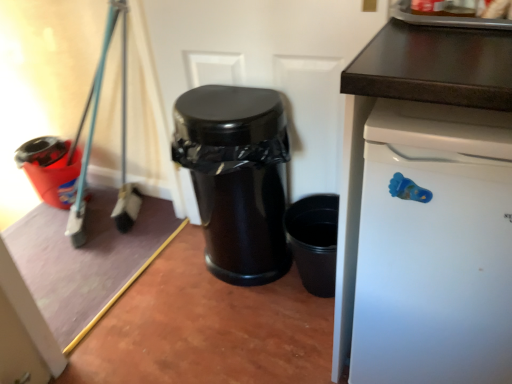
Question: Is point (59, 142) closer or farther from the camera than point (234, 142)?

Choices:
 (A) closer
 (B) farther

Answer: (B)

Question: Looking at the image, does matte plastic bucket at left, placed as the 2th waste container when sorted from front to back, seem bigger or smaller compared to glossy black trash can at center, the second waste container when ordered from left to right?

Choices:
 (A) small
 (B) big

Answer: (A)

Question: Which object is the farthest from the white matte dishwasher at right?

Choices:
 (A) glossy black trash can at center, which is the second waste container in back-to-front order
 (B) matte plastic bucket at left, placed as the 2th waste container when sorted from front to back

Answer: (B)

Question: Based on their relative distances, which object is farther from the white matte dishwasher at right?

Choices:
 (A) glossy black trash can at center, positioned as the first waste container in right-to-left order
 (B) matte plastic bucket at left, the first waste container when ordered from back to front

Answer: (B)